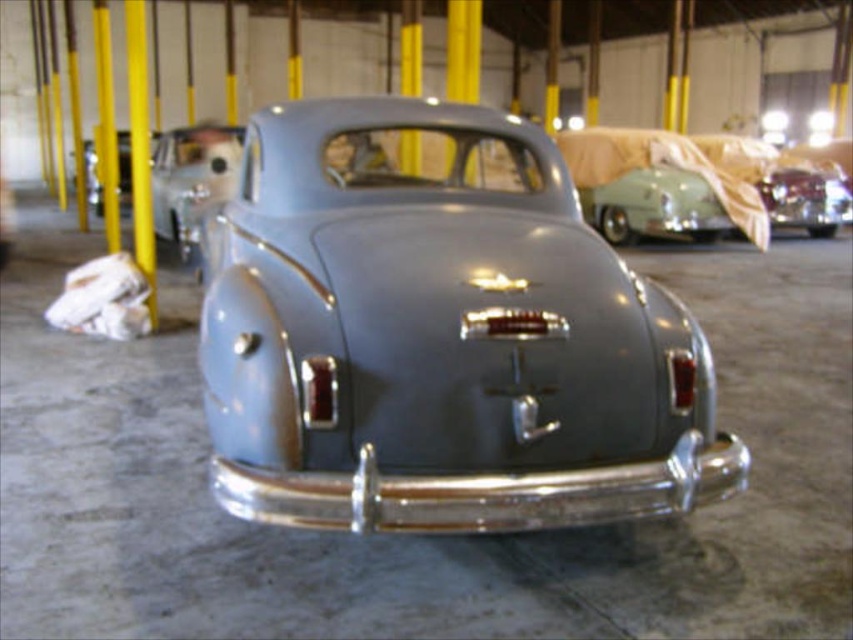
You are a delivery driver who needs to park your truck in the warehouse where the satin gray car at center and the matte gray car at center are parked. The truck requires a parking spot that is at least as tall as the tallest car in the scene. Which car should you use as a reference for the minimum height requirement?

The matte gray car at center is taller than the satin gray car at center. Therefore, you should use the matte gray car at center as the reference for the minimum height requirement since it is the tallest car in the scene.

You are a parking attendant who needs to fit both the satin gray car at center and the matte gray car at center into a single parking spot that can only accommodate one car. Based on their sizes, which car should you choose to park?

The satin gray car at center is larger in size than the matte gray car at center, so you should choose the matte gray car at center to park since it is smaller and will fit better in the single parking spot designed for one car.